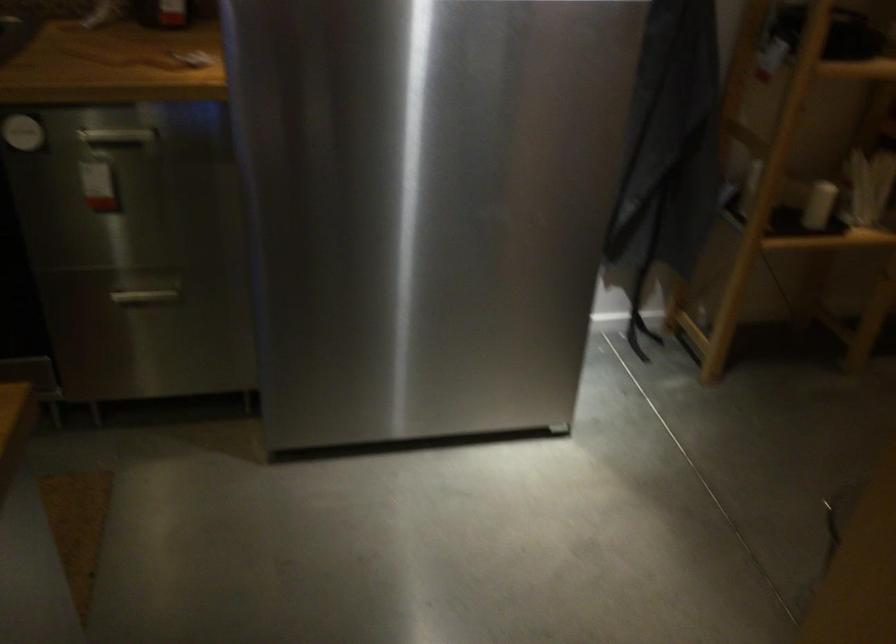
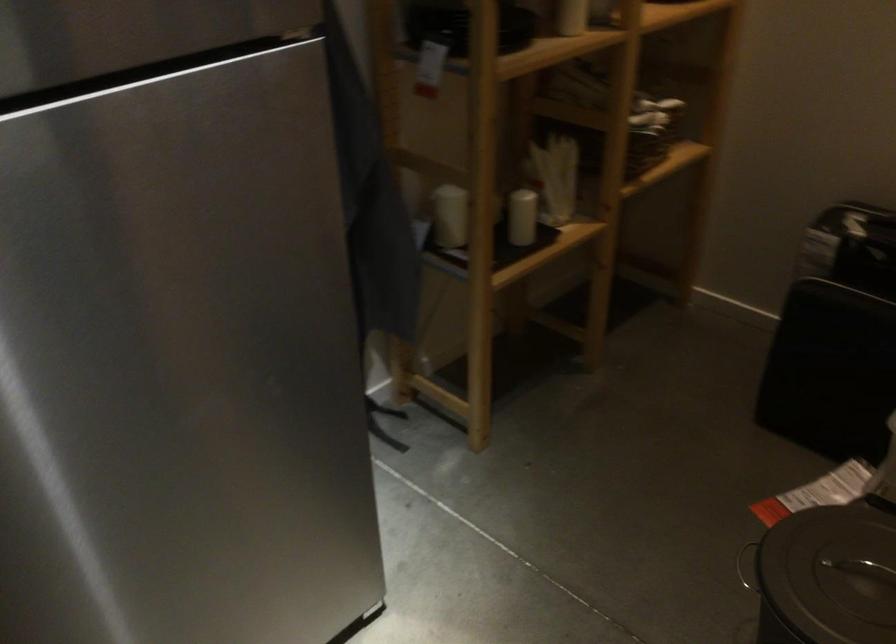
Locate, in the second image, the point that corresponds to pixel 817 194 in the first image.

(521, 216)